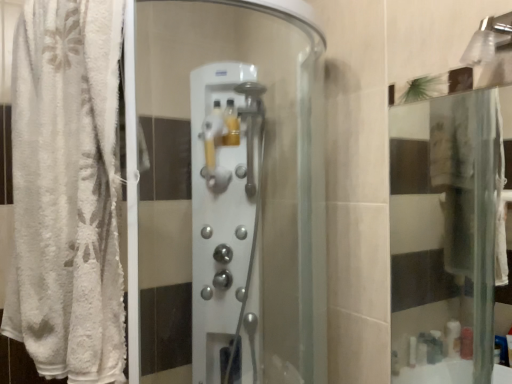
What do you see at coordinates (226, 222) in the screenshot?
I see `satin silver shower controls at center` at bounding box center [226, 222].

Where is `satin silver shower controls at center`? The image size is (512, 384). satin silver shower controls at center is located at coordinates (226, 222).

The height and width of the screenshot is (384, 512). Find the location of `white fluffy towel at left`. white fluffy towel at left is located at coordinates (67, 190).

The width and height of the screenshot is (512, 384). What do you see at coordinates (67, 190) in the screenshot?
I see `white fluffy towel at left` at bounding box center [67, 190].

This screenshot has height=384, width=512. I want to click on satin silver shower controls at center, so click(226, 222).

Does satin silver shower controls at center appear on the right side of white fluffy towel at left?

Correct, you'll find satin silver shower controls at center to the right of white fluffy towel at left.

Which object is further away from the camera, satin silver shower controls at center or white fluffy towel at left?

Positioned behind is satin silver shower controls at center.

Does point (228, 254) appear closer or farther from the camera than point (57, 100)?

Clearly, point (228, 254) is more distant from the camera than point (57, 100).

From the image's perspective, is satin silver shower controls at center located above or below white fluffy towel at left?

From the image's perspective, satin silver shower controls at center appears below white fluffy towel at left.

From a real-world perspective, is satin silver shower controls at center physically below white fluffy towel at left?

Yes, from a real-world perspective, satin silver shower controls at center is beneath white fluffy towel at left.

Is satin silver shower controls at center wider than white fluffy towel at left?

Yes.

Considering the relative sizes of satin silver shower controls at center and white fluffy towel at left in the image provided, is satin silver shower controls at center shorter than white fluffy towel at left?

Incorrect, the height of satin silver shower controls at center does not fall short of that of white fluffy towel at left.

Who is smaller, satin silver shower controls at center or white fluffy towel at left?

satin silver shower controls at center is smaller.

Choose the correct answer: Is satin silver shower controls at center inside white fluffy towel at left or outside it?

The correct answer is: outside.

Is satin silver shower controls at center positioned far away from white fluffy towel at left?

No, satin silver shower controls at center is in close proximity to white fluffy towel at left.

Does satin silver shower controls at center turn towards white fluffy towel at left?

No, satin silver shower controls at center is not turned towards white fluffy towel at left.

Can you tell me how much satin silver shower controls at center and white fluffy towel at left differ in facing direction?

They differ by 84.6 degrees in their facing directions.

Measure the distance from satin silver shower controls at center to white fluffy towel at left.

satin silver shower controls at center and white fluffy towel at left are 45.73 centimeters apart.

Locate an element on the screen. The width and height of the screenshot is (512, 384). screen door below the white fluffy towel at left (from a real-world perspective) is located at coordinates (226, 222).

Can you confirm if white fluffy towel at left is positioned to the right of satin silver shower controls at center?

No, white fluffy towel at left is not to the right of satin silver shower controls at center.

Considering the positions of objects white fluffy towel at left and satin silver shower controls at center in the image provided, who is in front, white fluffy towel at left or satin silver shower controls at center?

Positioned in front is white fluffy towel at left.

Does point (28, 103) lie in front of point (253, 354)?

Yes, point (28, 103) is closer to viewer.

From the image's perspective, is white fluffy towel at left located beneath satin silver shower controls at center?

No.

From a real-world perspective, does white fluffy towel at left sit lower than satin silver shower controls at center?

Incorrect, from a real-world perspective, white fluffy towel at left is higher than satin silver shower controls at center.

Which of these two, white fluffy towel at left or satin silver shower controls at center, is wider?

With larger width is satin silver shower controls at center.

From their relative heights in the image, would you say white fluffy towel at left is taller or shorter than satin silver shower controls at center?

white fluffy towel at left is shorter than satin silver shower controls at center.

Can you confirm if white fluffy towel at left is smaller than satin silver shower controls at center?

Incorrect, white fluffy towel at left is not smaller in size than satin silver shower controls at center.

Is white fluffy towel at left spatially inside satin silver shower controls at center, or outside of it?

white fluffy towel at left is not enclosed by satin silver shower controls at center.

Is white fluffy towel at left next to satin silver shower controls at center?

No, white fluffy towel at left is not with satin silver shower controls at center.

Could you tell me if white fluffy towel at left is turned towards satin silver shower controls at center?

No, white fluffy towel at left is not oriented towards satin silver shower controls at center.

How different are the orientations of white fluffy towel at left and satin silver shower controls at center in degrees?

The angle between the facing direction of white fluffy towel at left and the facing direction of satin silver shower controls at center is 84.6 degrees.

Where is `screen door behind the white fluffy towel at left`? Image resolution: width=512 pixels, height=384 pixels. screen door behind the white fluffy towel at left is located at coordinates (226, 222).

This screenshot has width=512, height=384. I want to click on curtain on the left side of satin silver shower controls at center, so click(67, 190).

You are a GUI agent. You are given a task and a screenshot of the screen. Output one action in this format:
    pyautogui.click(x=<x>, y=<y>)
    Task: Click on the screen door that is behind the white fluffy towel at left
    
    Given the screenshot: What is the action you would take?
    pyautogui.click(x=226, y=222)